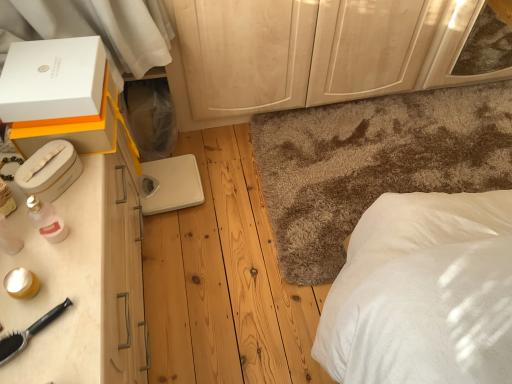
The image size is (512, 384). Identify the location of vacant space in front of pink glass perfume at left. (52, 284).